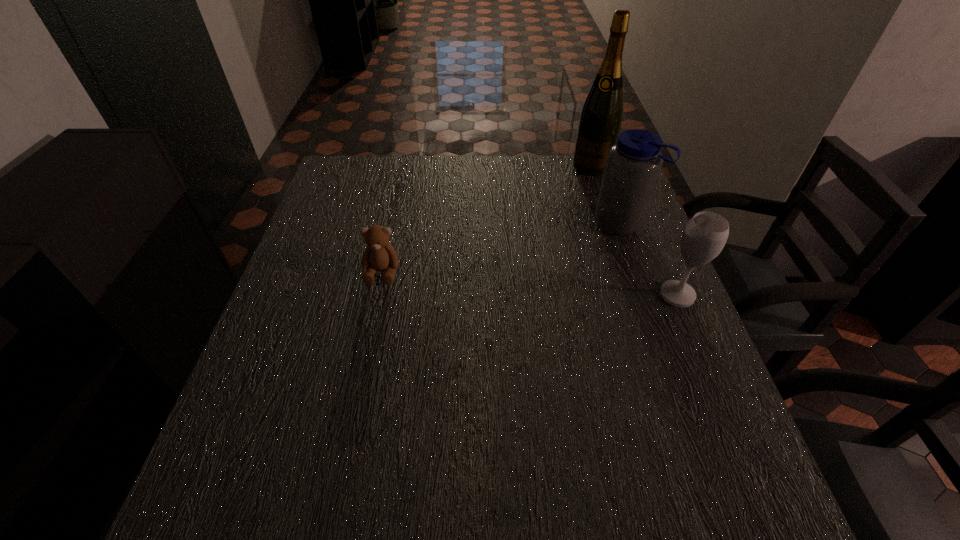
The width and height of the screenshot is (960, 540). I want to click on vacant space located 0.260m on the front-facing side of the farthest object, so click(x=563, y=225).

Find the location of a particular element. The width and height of the screenshot is (960, 540). vacant space situated 0.150m with a carrying loop on the side of the third nearest object is located at coordinates click(575, 263).

The width and height of the screenshot is (960, 540). I want to click on vacant area situated 0.180m with a carrying loop on the side of the third nearest object, so click(568, 269).

Locate an element on the screen. free location located 0.250m with a carrying loop on the side of the third nearest object is located at coordinates (551, 285).

Identify the location of object that is at the far edge. (600, 121).

Identify the location of wineglass at the right edge. (704, 236).

This screenshot has height=540, width=960. In order to click on wine bottle that is at the right edge in this screenshot , I will do pyautogui.click(x=600, y=121).

Where is `water bottle that is at the right edge`? The height and width of the screenshot is (540, 960). water bottle that is at the right edge is located at coordinates click(x=633, y=164).

You are a GUI agent. You are given a task and a screenshot of the screen. Output one action in this format:
    pyautogui.click(x=<x>, y=<y>)
    Task: Click on the object at the far right corner
    
    Given the screenshot: What is the action you would take?
    [600, 121]

In the image, there is a desktop. Identify the location of vacant space at the far edge. (427, 178).